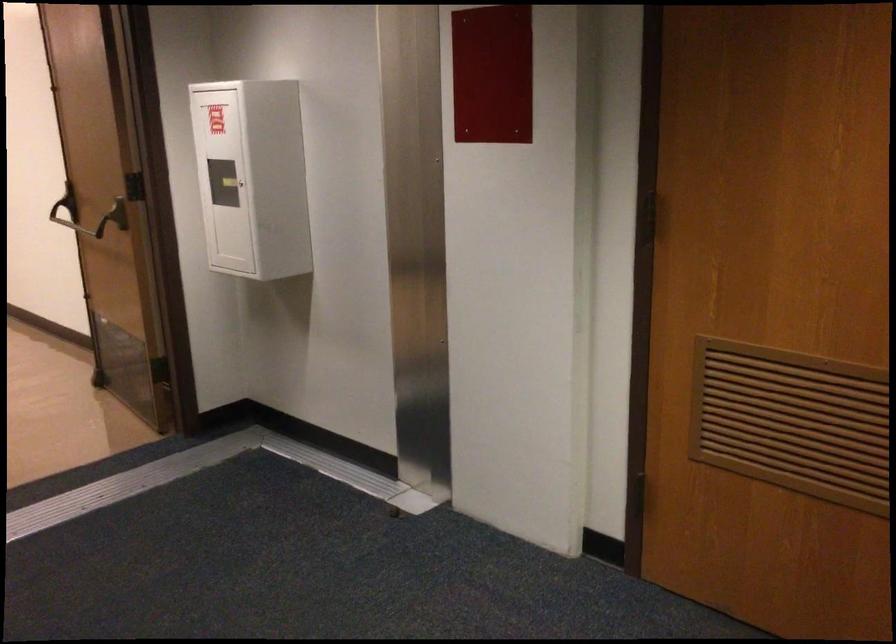
Locate an element on the screen. This screenshot has width=896, height=644. cabinet lock is located at coordinates (233, 183).